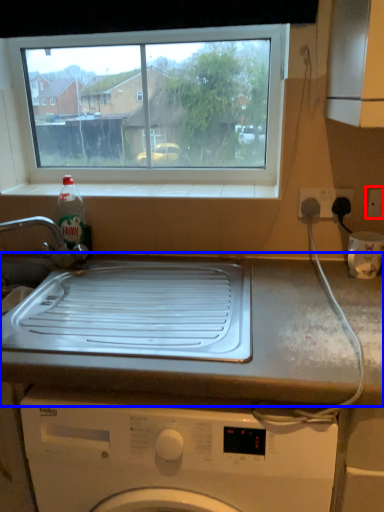
Question: Which object is closer to the camera taking this photo, electric outlet (highlighted by a red box) or countertop (highlighted by a blue box)?

Choices:
 (A) electric outlet
 (B) countertop

Answer: (B)